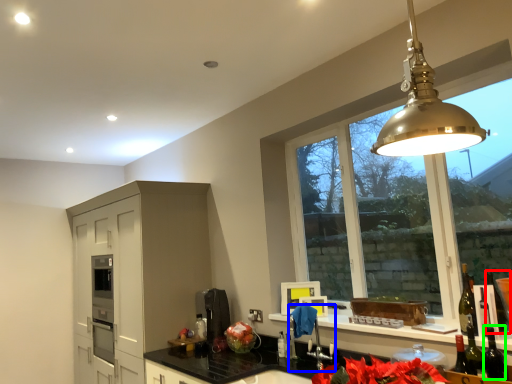
Question: Which object is positioned closest to wine bottle (highlighted by a red box)? Select from faucet (highlighted by a blue box) and wine bottle (highlighted by a green box).

Choices:
 (A) faucet
 (B) wine bottle

Answer: (B)